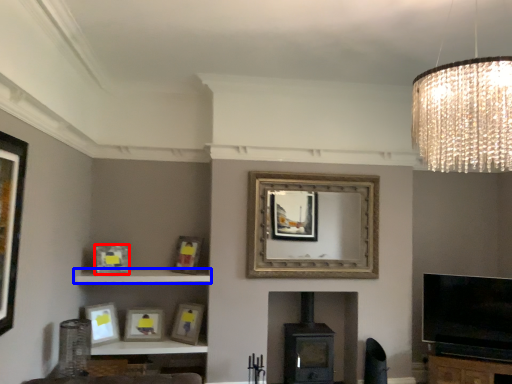
Question: Among these objects, which one is nearest to the camera, picture frame (highlighted by a red box) or shelf (highlighted by a blue box)?

Choices:
 (A) picture frame
 (B) shelf

Answer: (B)